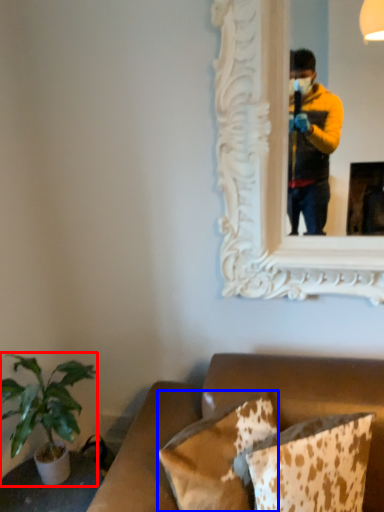
Question: Which of the following is the farthest to the observer, houseplant (highlighted by a red box) or pillow (highlighted by a blue box)?

Choices:
 (A) houseplant
 (B) pillow

Answer: (A)